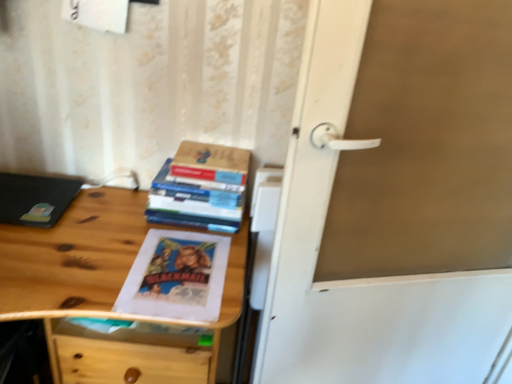
Locate an element on the screen. vacant position to the left of hardcover books at center is located at coordinates (115, 215).